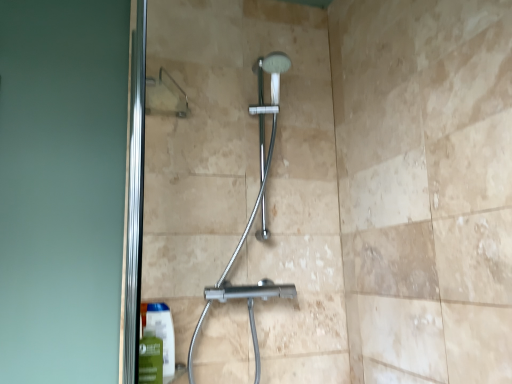
Question: Is chrome metallic shower at center positioned beyond the bounds of transparent glass door at upper left?

Choices:
 (A) no
 (B) yes

Answer: (B)

Question: Can you confirm if chrome metallic shower at center is shorter than transparent glass door at upper left?

Choices:
 (A) no
 (B) yes

Answer: (B)

Question: Is chrome metallic shower at center wider than transparent glass door at upper left?

Choices:
 (A) yes
 (B) no

Answer: (A)

Question: Does chrome metallic shower at center have a smaller size compared to transparent glass door at upper left?

Choices:
 (A) yes
 (B) no

Answer: (B)

Question: Is chrome metallic shower at center to the right of transparent glass door at upper left from the viewer's perspective?

Choices:
 (A) no
 (B) yes

Answer: (B)

Question: Considering the relative sizes of chrome metallic shower at center and transparent glass door at upper left in the image provided, is chrome metallic shower at center bigger than transparent glass door at upper left?

Choices:
 (A) yes
 (B) no

Answer: (A)

Question: Is transparent glass door at upper left facing away from green matte mouthwash at lower left?

Choices:
 (A) no
 (B) yes

Answer: (B)

Question: From a real-world perspective, is transparent glass door at upper left physically above green matte mouthwash at lower left?

Choices:
 (A) no
 (B) yes

Answer: (B)

Question: Does transparent glass door at upper left have a larger size compared to green matte mouthwash at lower left?

Choices:
 (A) no
 (B) yes

Answer: (B)

Question: From a real-world perspective, is transparent glass door at upper left under green matte mouthwash at lower left?

Choices:
 (A) yes
 (B) no

Answer: (B)

Question: Is transparent glass door at upper left further to camera compared to green matte mouthwash at lower left?

Choices:
 (A) yes
 (B) no

Answer: (A)

Question: Could you tell me if transparent glass door at upper left is facing green matte mouthwash at lower left?

Choices:
 (A) yes
 (B) no

Answer: (A)

Question: Considering the relative sizes of green matte mouthwash at lower left and chrome metallic shower at center in the image provided, is green matte mouthwash at lower left taller than chrome metallic shower at center?

Choices:
 (A) no
 (B) yes

Answer: (A)